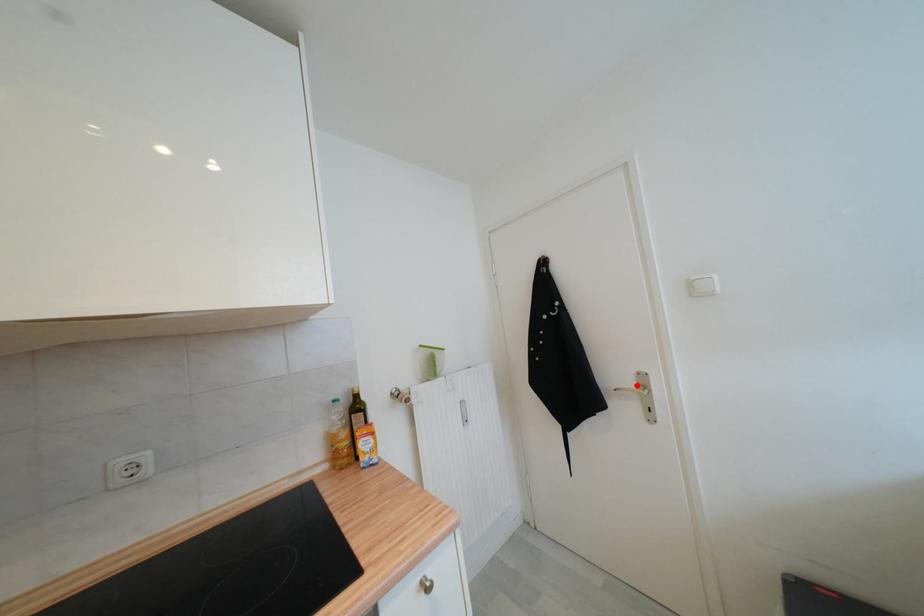
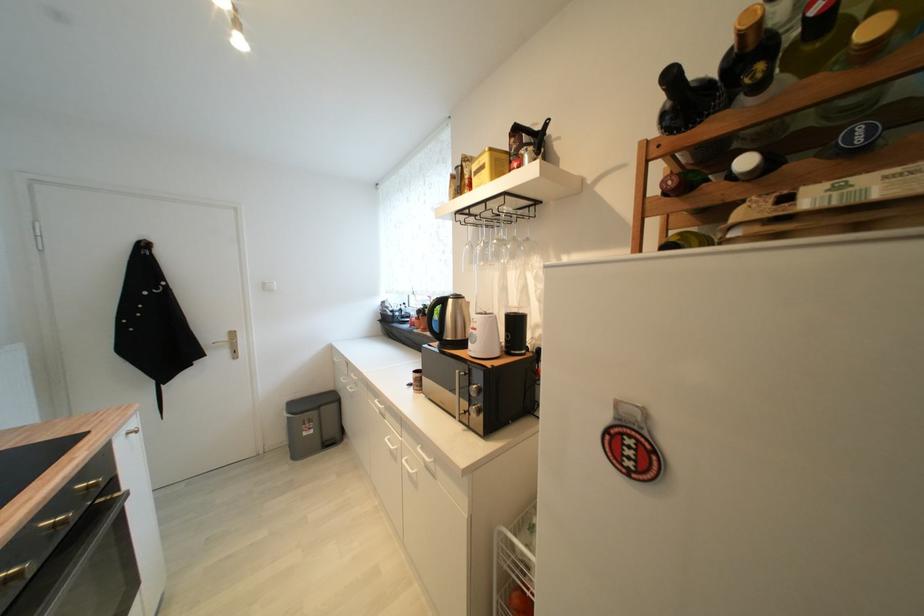
In the second image, find the point that corresponds to the highlighted location in the first image.

(229, 339)